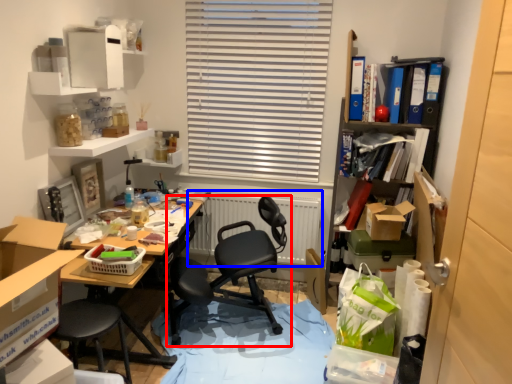
Question: Among these objects, which one is nearest to the camera, chair (highlighted by a red box) or radiator (highlighted by a blue box)?

Choices:
 (A) chair
 (B) radiator

Answer: (A)